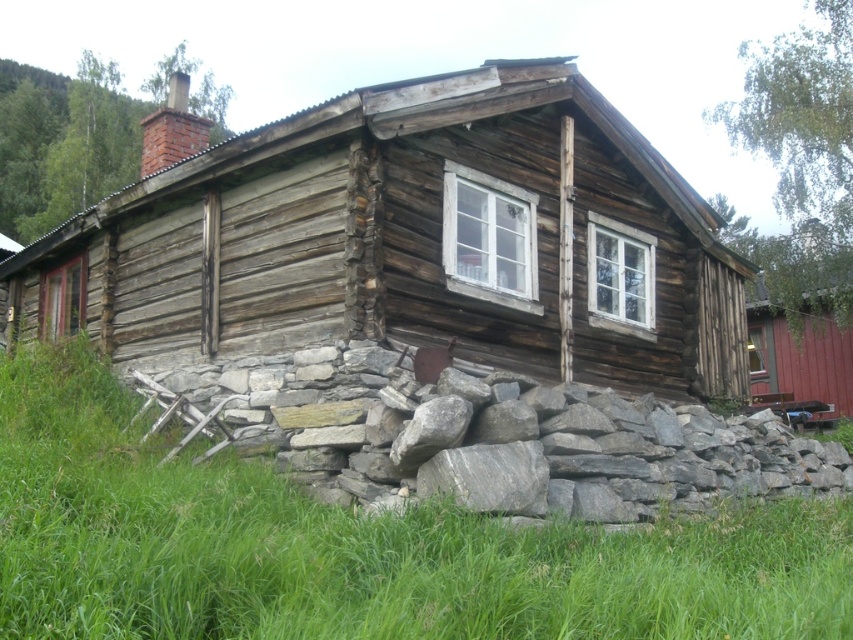
From the picture: Who is more distant from viewer, (344, 122) or (288, 570)?

The point (344, 122) is more distant.

Who is positioned more to the right, weathered wood cabin at center or green grass at lower center?

green grass at lower center is more to the right.

Who is more forward, (483,120) or (721,605)?

Point (721,605) is more forward.

Find the location of a particular element. The width and height of the screenshot is (853, 640). weathered wood cabin at center is located at coordinates (410, 241).